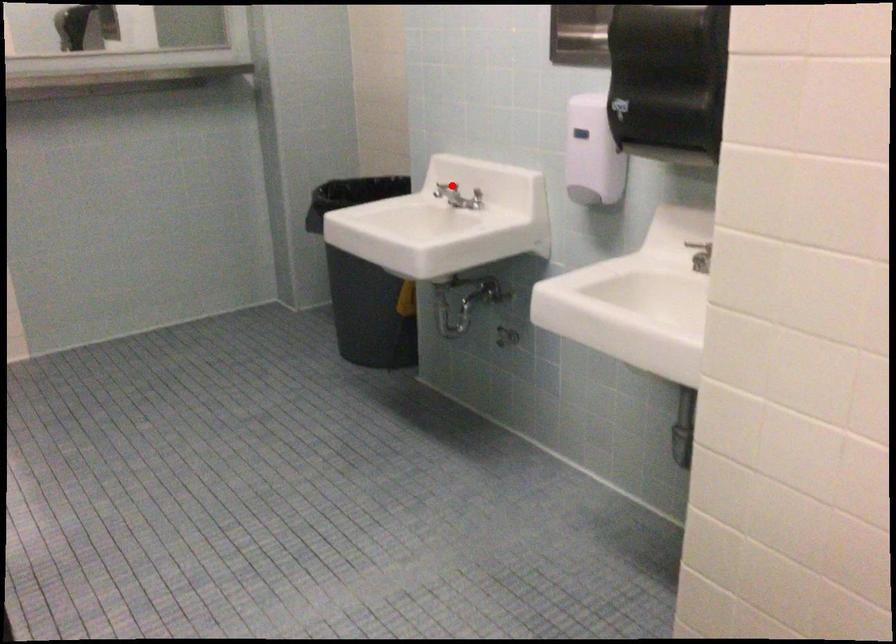
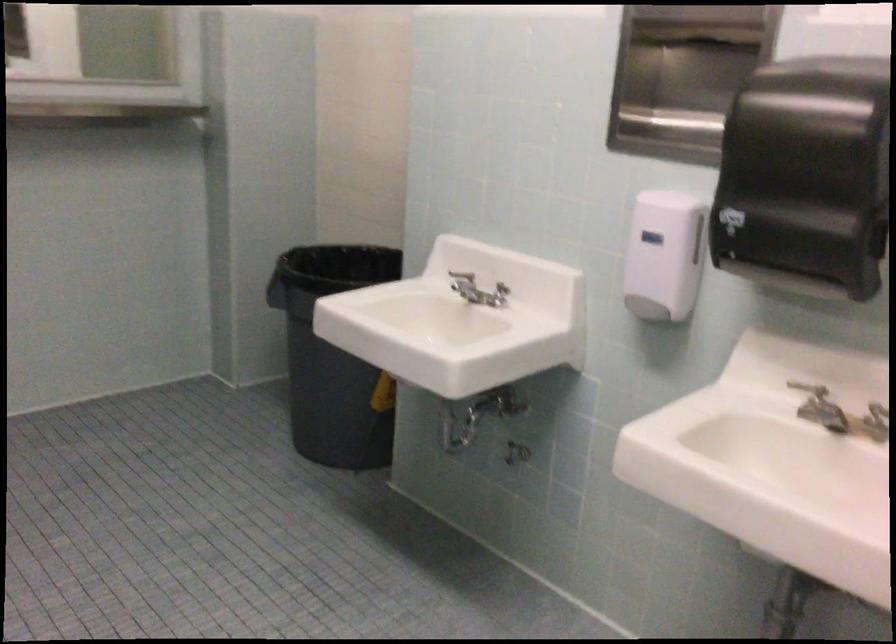
Locate, in the second image, the point that corresponds to the highlighted location in the first image.

(462, 275)